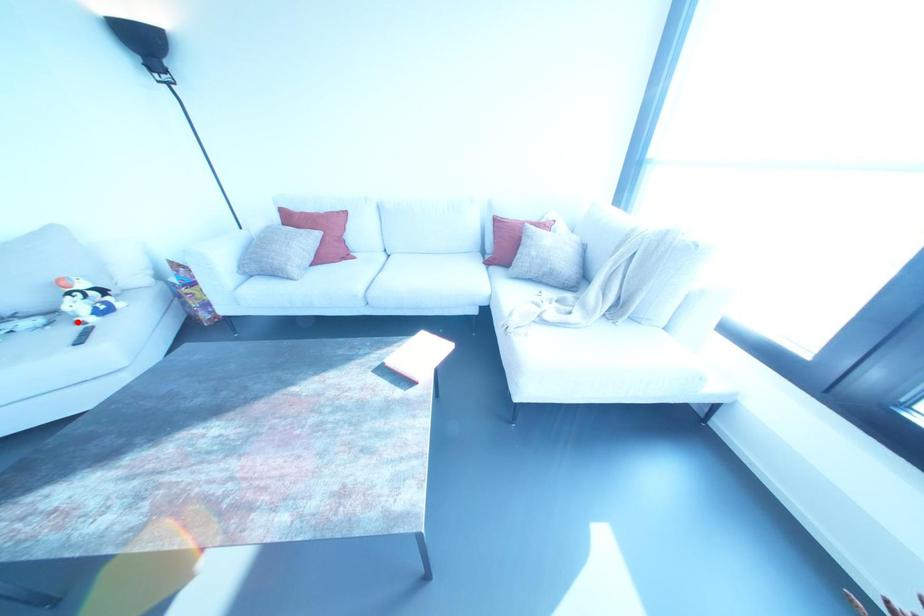
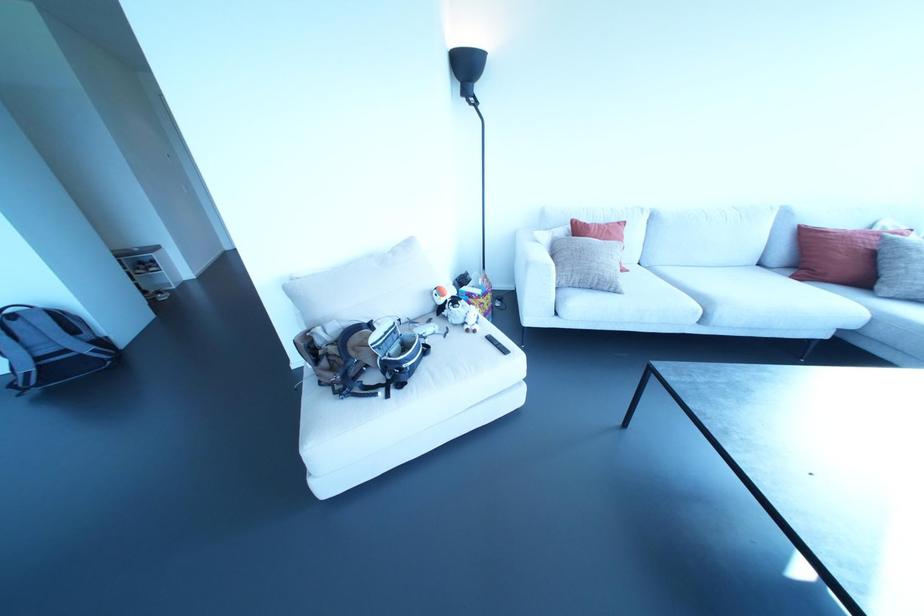
In the second image, find the point that corresponds to the highlighted location in the first image.

(467, 330)